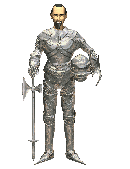
At what (x,y) coordinates should I click in order to perform the action: click on chest. Please return your answer as a coordinate pair (x, y). Looking at the image, I should click on (52, 44), (66, 41).